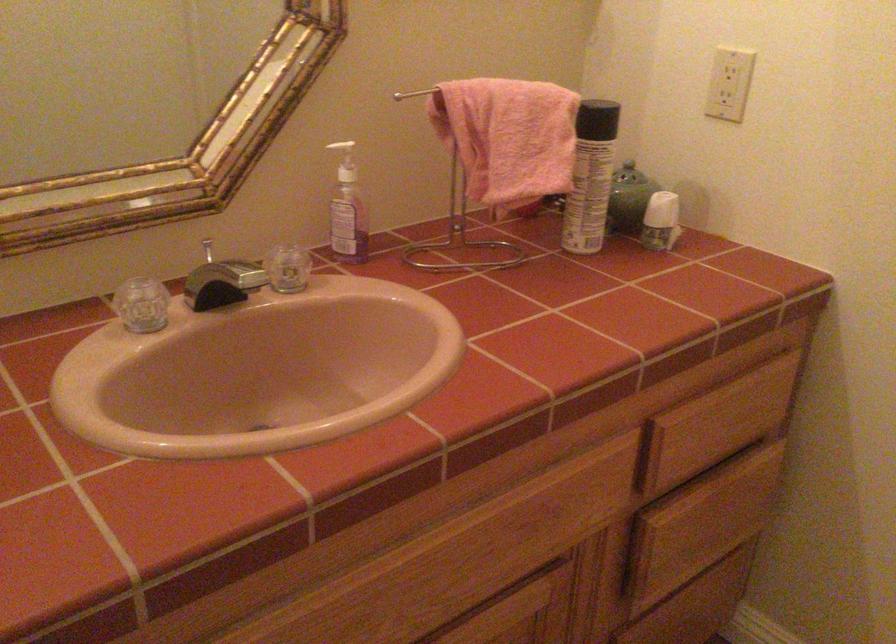
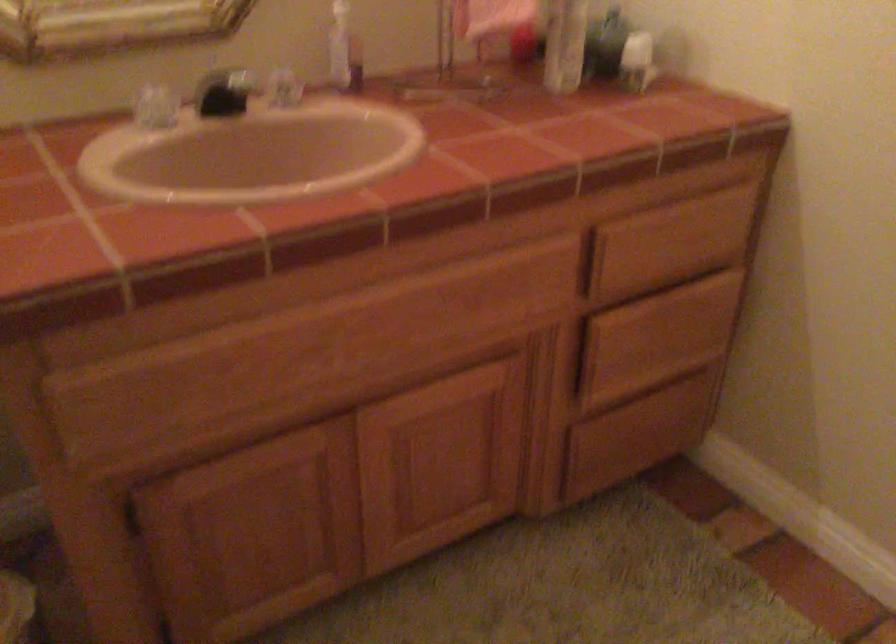
Which direction would the cameraman need to move to produce the second image?

The cameraman moved toward right, backward.